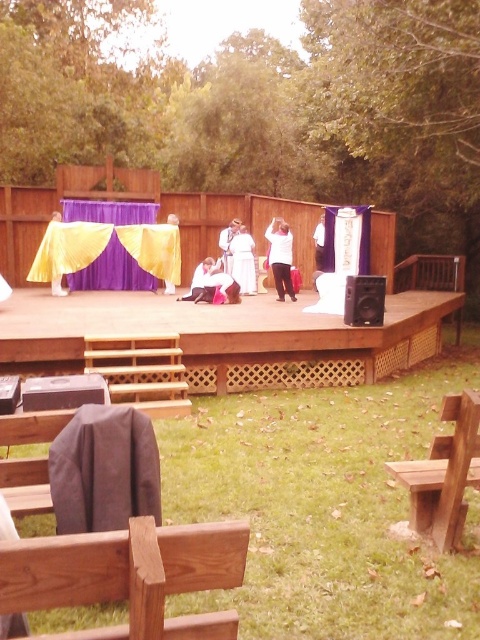
Question: Which object is closer to the camera taking this photo?

Choices:
 (A) yellow satin dress at center
 (B) white cotton dress at center
 (C) purple satin curtain at center

Answer: (A)

Question: Can you confirm if purple satin curtain at center is wider than white cotton dress at center?

Choices:
 (A) no
 (B) yes

Answer: (B)

Question: Which point is farther from the camera taking this photo?

Choices:
 (A) (377, 301)
 (B) (127, 202)
 (C) (61, 541)
 (D) (175, 220)

Answer: (B)

Question: Is white matte shirt at center closer to camera compared to white cotton dress at center?

Choices:
 (A) no
 (B) yes

Answer: (B)

Question: Which object appears farthest from the camera in this image?

Choices:
 (A) purple satin curtain at center
 (B) brown wooden bench at lower right
 (C) wooden bench at lower left

Answer: (A)

Question: Does brown wooden bench at lower right have a smaller size compared to smooth white shirt at center?

Choices:
 (A) no
 (B) yes

Answer: (B)